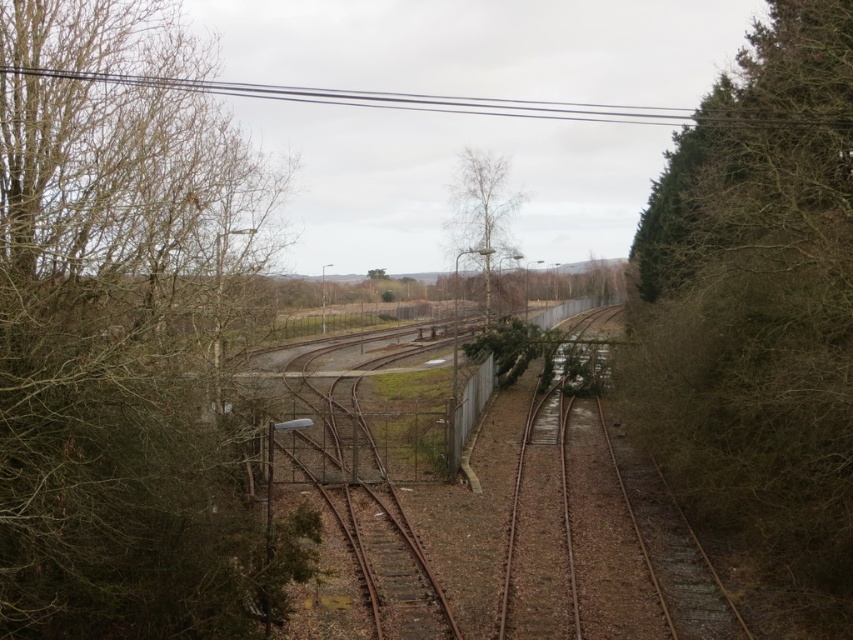
You are a photographer standing on the railway tracks. You want to take a photo that includes both the brown leafless tree at left and the green leafy tree at right. Which tree should you position closer to the center of your camera frame to ensure both are fully visible in the photo?

The brown leafless tree at left is smaller than the green leafy tree at right. To ensure both are fully visible, position the smaller brown leafless tree at left closer to the center of your camera frame since it requires less space in the frame compared to the larger green leafy tree at right.

You are a photographer standing at the center of the railway tracks. You want to capture a photo that includes both the brown leafless tree at left and the green leafy tree at right. Which tree should you position closer to the edge of your camera frame to ensure both are fully visible?

You should position the brown leafless tree at left closer to the edge of your camera frame because it might be wider than the green leafy tree at right, so giving it more space on the left side will help ensure both trees are fully visible in the photo.

In the scene shown: You are standing on the railway tracks and looking towards the direction of the train. You see a brown leafless tree at left and a bare wood tree at center. Which tree is closer to your left side?

The brown leafless tree at left is closer to your left side because it is positioned to the left of the bare wood tree at center.